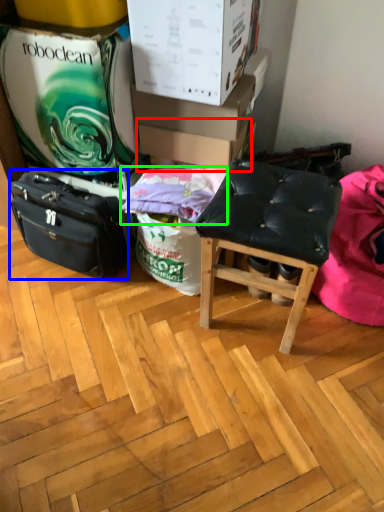
Question: Estimate the real-world distances between objects in this image. Which object is farther from cardboard box (highlighted by a red box), luggage and bags (highlighted by a blue box) or pillow (highlighted by a green box)?

Choices:
 (A) luggage and bags
 (B) pillow

Answer: (A)